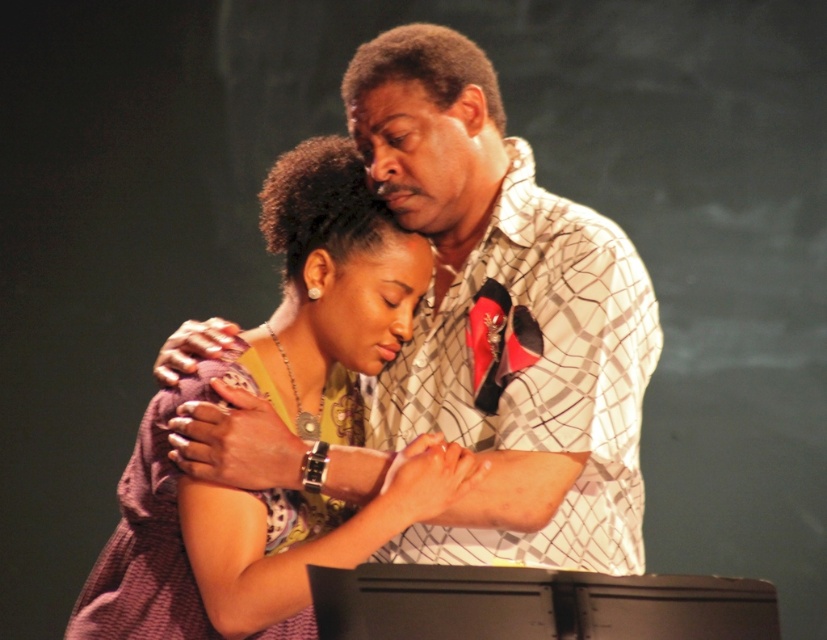
You are an actor positioned at the center of the stage. You see the white checkered shirt at upper center marked by point (465, 333). If you move 0.3 units to the right, will you be closer to the edge of the stage?

Moving 0.3 units to the right from point (465, 333) would place you at 0.822 on the x axis. Since the stage extends from 0 to 1, 0.822 is still within the stage boundaries, so you are not closer to the edge of the stage.

You are a costume designer reviewing a scene where two characters are interacting. The scene has a white checkered shirt at upper center and a purple fabric dress at center. Which clothing item is placed higher in the image?

The white checkered shirt at upper center is positioned higher than the purple fabric dress at center.

You are a costume designer preparing for a play. You have two costumes to place on a rack. The white checkered shirt at upper center and the purple fabric dress at center. Which costume should you choose if you need to cover a larger body size?

The white checkered shirt at upper center has a larger size compared to the purple fabric dress at center, so it is better suited for covering a larger body size.